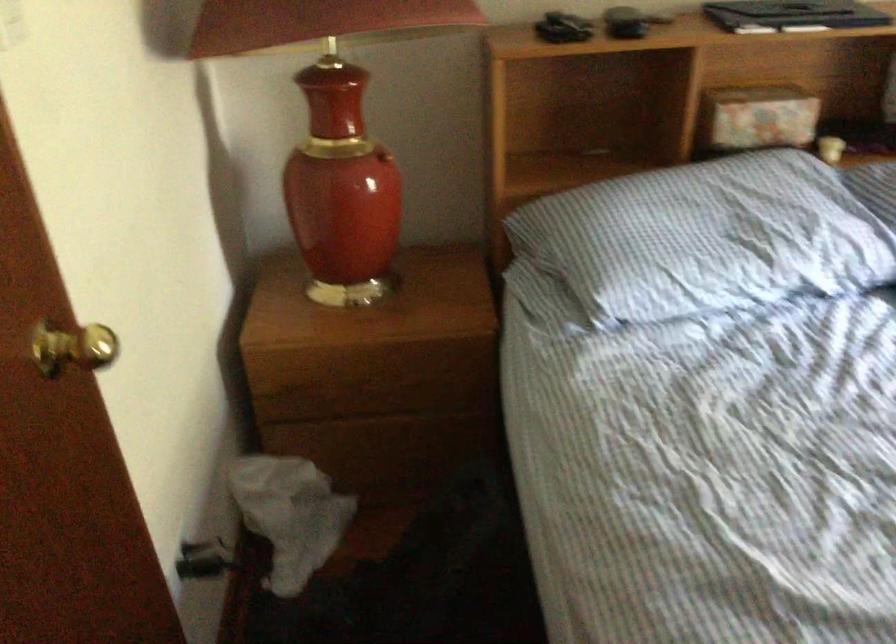
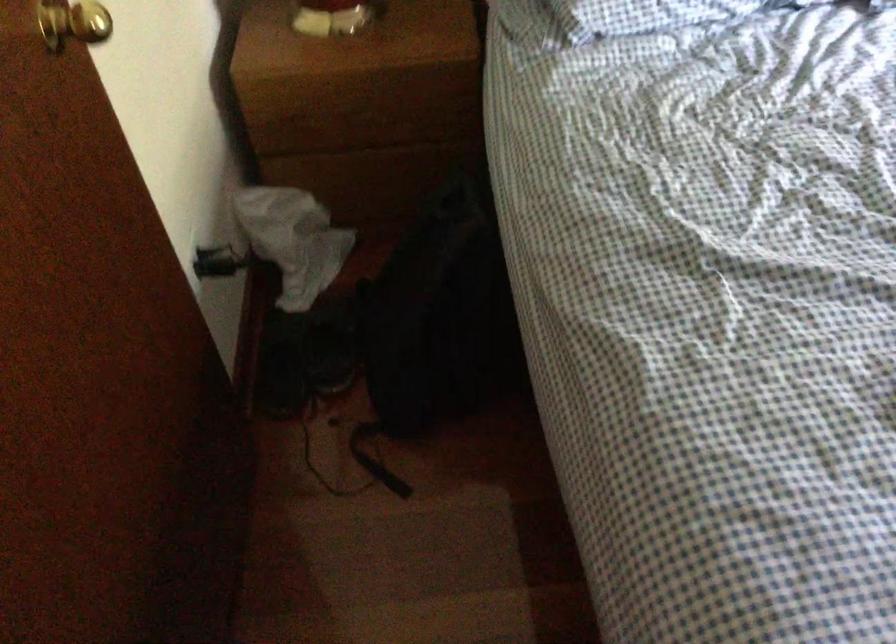
Where in the second image is the point corresponding to [76,341] from the first image?

(73, 23)